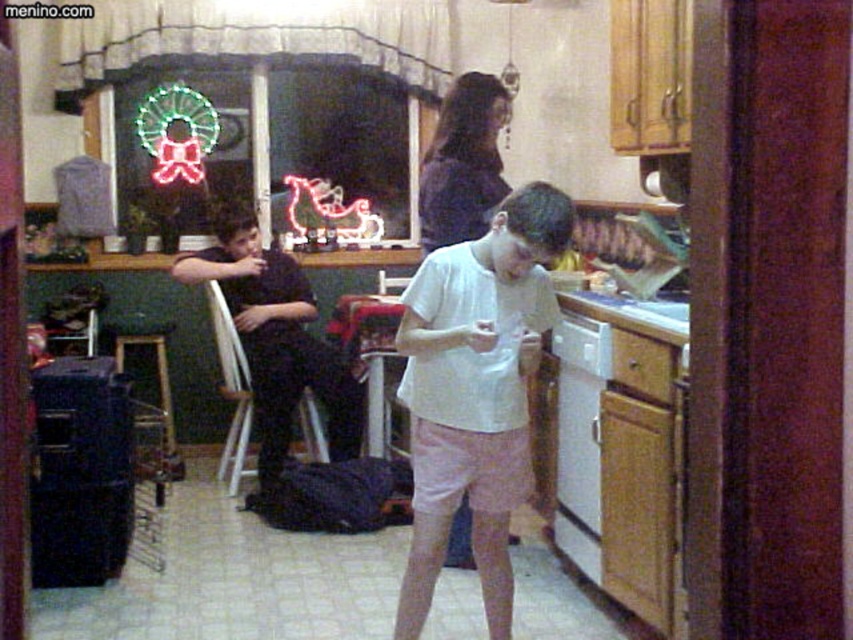
You are a guest in this kitchen and want to greet the person wearing the dark purple blouse at center. Which direction should you walk towards from the black cotton shirt at left?

The dark purple blouse at center is to the right of the black cotton shirt at left, so you should walk towards the right to greet the person wearing the dark purple blouse at center.

Looking at this image, you are organizing a party and need to know which item takes up more space horizontally. Which is wider between the black cotton shirt at left and the white plastic dishwasher at lower center?

The black cotton shirt at left is wider than the white plastic dishwasher at lower center according to the description.

You are organizing a laundry day and need to sort the white cotton shirt at center and the black cotton shirt at left based on their positions. Which shirt is located to the right of the other?

The white cotton shirt at center is positioned on the right side of black cotton shirt at left.